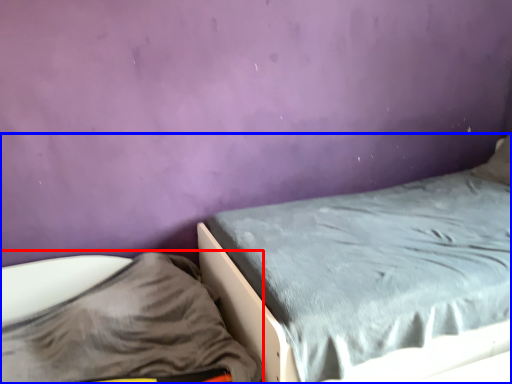
Question: Which point is closer to the camera, sheet (highlighted by a red box) or bed (highlighted by a blue box)?

Choices:
 (A) sheet
 (B) bed

Answer: (A)